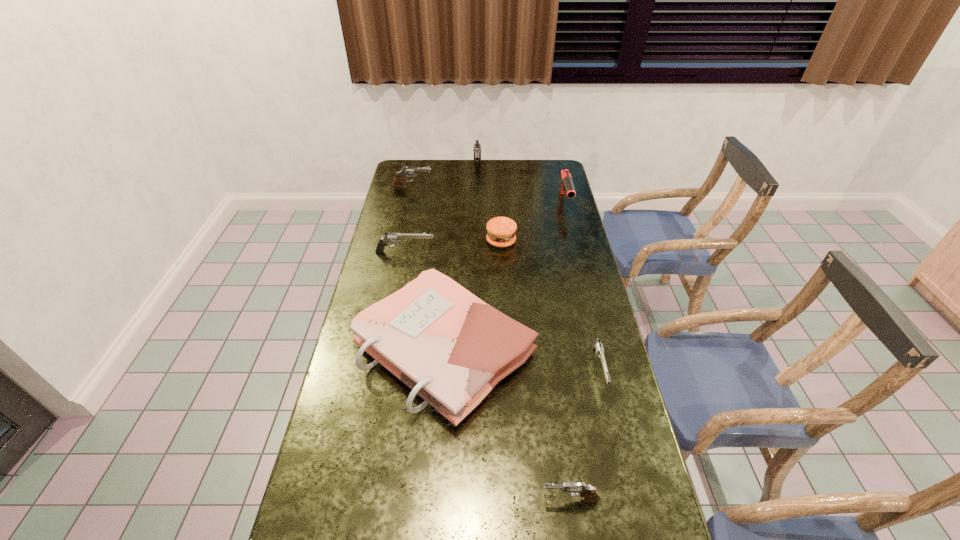
Identify the location of the smallest gray pistol. This screenshot has width=960, height=540. (590, 493).

I want to click on the shortest pistol, so click(x=596, y=344).

Identify the location of the nearer silver pistol. The height and width of the screenshot is (540, 960). (596, 344).

The width and height of the screenshot is (960, 540). Find the location of `vacant region located at the barrel of the tallest pistol`. vacant region located at the barrel of the tallest pistol is located at coordinates (477, 221).

In order to click on free space located at the aiming end of the black gun in this screenshot , I will do `click(577, 251)`.

What are the coordinates of `blank area located 0.060m at the barrel of the leftmost gray pistol` in the screenshot? It's located at (445, 188).

The width and height of the screenshot is (960, 540). Find the location of `free spot located 0.170m on the front of the phonebook`. free spot located 0.170m on the front of the phonebook is located at coordinates (434, 501).

The image size is (960, 540). Identify the location of blank space located 0.370m on the front of the patty. (506, 324).

Find the location of a particular element. The width and height of the screenshot is (960, 540). vacant space located on the front-facing side of the left silver pistol is located at coordinates (518, 252).

This screenshot has height=540, width=960. I want to click on free spot located at the barrel of the nearest pistol, so click(x=438, y=500).